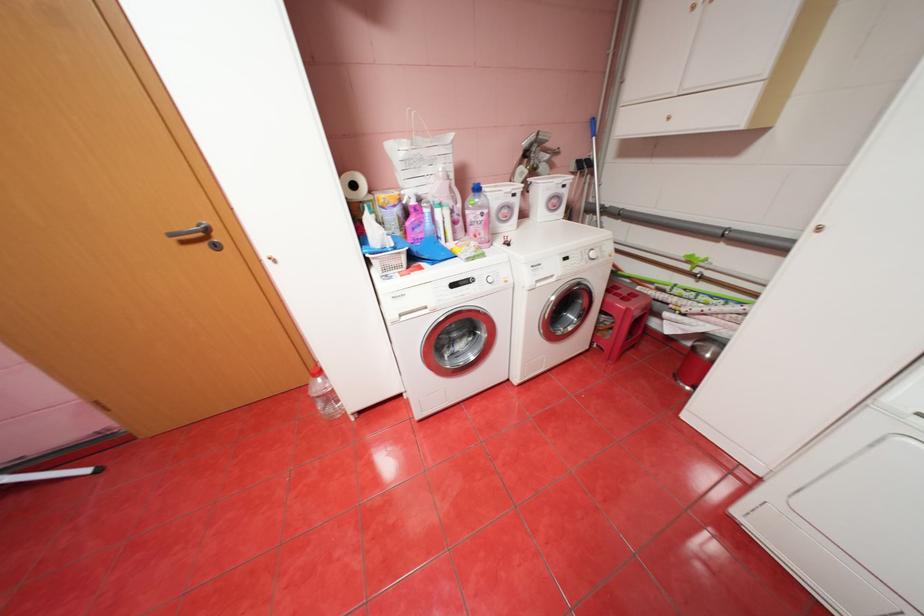
The height and width of the screenshot is (616, 924). I want to click on chair sitting surface, so click(x=627, y=297).